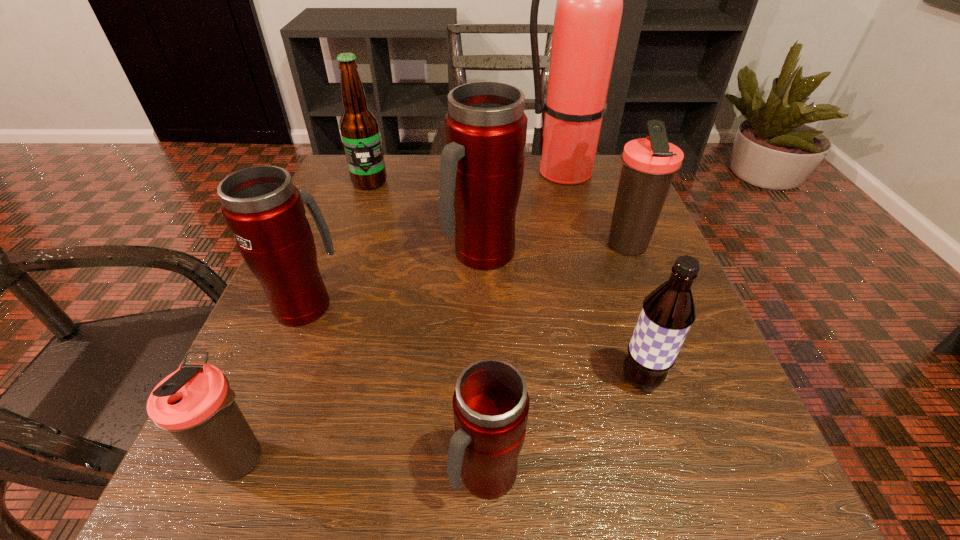
You are a GUI agent. You are given a task and a screenshot of the screen. Output one action in this format:
    pyautogui.click(x=<x>, y=<y>)
    Task: Click on the nearest red thermos bottle
    
    Given the screenshot: What is the action you would take?
    pyautogui.click(x=490, y=403)

The width and height of the screenshot is (960, 540). I want to click on the smaller brown thermos bottle, so click(195, 403).

Identify the location of the nearer brown thermos bottle. The height and width of the screenshot is (540, 960). (195, 403).

I want to click on free space located 0.110m on the hose direction of the fire extinguisher, so click(x=474, y=172).

The height and width of the screenshot is (540, 960). Identify the location of free space located on the hose direction of the fire extinguisher. [x=399, y=172].

Find the location of a particular element. This screenshot has height=540, width=960. vacant space located on the hose direction of the fire extinguisher is located at coordinates (483, 172).

Locate an element on the screen. The image size is (960, 540). vacant point located 0.090m on the side with the handle of the biggest red thermos bottle is located at coordinates (482, 317).

You are a GUI agent. You are given a task and a screenshot of the screen. Output one action in this format:
    pyautogui.click(x=<x>, y=<y>)
    Task: Click on the free location located 0.360m on the label of the beer bottle
    
    Given the screenshot: What is the action you would take?
    click(326, 307)

Where is `vacant position located 0.150m on the left of the bigger brown thermos bottle`? This screenshot has width=960, height=540. vacant position located 0.150m on the left of the bigger brown thermos bottle is located at coordinates point(520,246).

Identify the location of vacant space situated 0.260m on the side with the handle of the fifth farthest object. Image resolution: width=960 pixels, height=540 pixels. (348, 200).